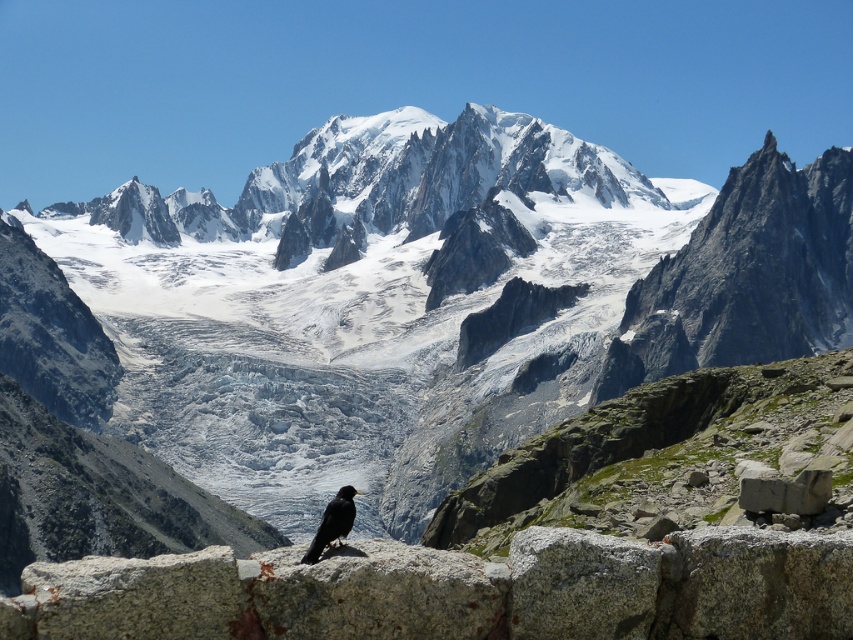
Question: Which of the following is the farthest from the observer?

Choices:
 (A) black matte bird at lower center
 (B) gray stone at lower right

Answer: (B)

Question: Does gray stone at lower right appear under black matte bird at lower center?

Choices:
 (A) no
 (B) yes

Answer: (A)

Question: In this image, where is gray stone at lower right located relative to black matte bird at lower center?

Choices:
 (A) right
 (B) left

Answer: (A)

Question: Which of the following is the farthest from the observer?

Choices:
 (A) black matte bird at lower center
 (B) gray stone at lower right

Answer: (B)

Question: Can you confirm if gray stone at lower right is positioned above black matte bird at lower center?

Choices:
 (A) yes
 (B) no

Answer: (A)

Question: Which point is farther to the camera?

Choices:
 (A) (761, 486)
 (B) (318, 531)

Answer: (B)